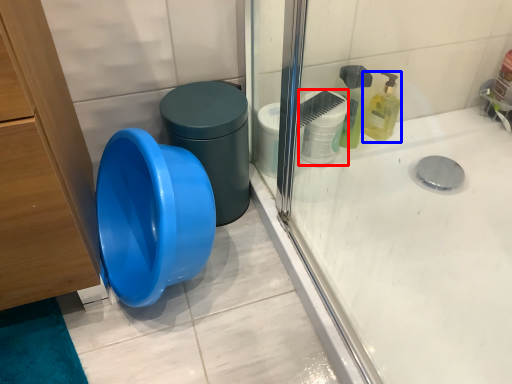
Question: Which of the following is the farthest to the observer, toilet paper (highlighted by a red box) or cleaning product (highlighted by a blue box)?

Choices:
 (A) toilet paper
 (B) cleaning product

Answer: (B)